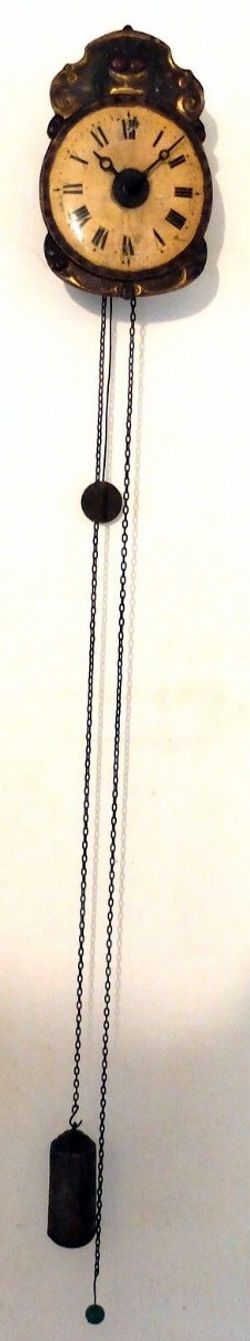
At what (x,y) coordinates should I click in order to perform the action: click on decorative top. Please return your answer as a coordinate pair (x, y). The image size is (250, 1341). Looking at the image, I should click on (120, 51).